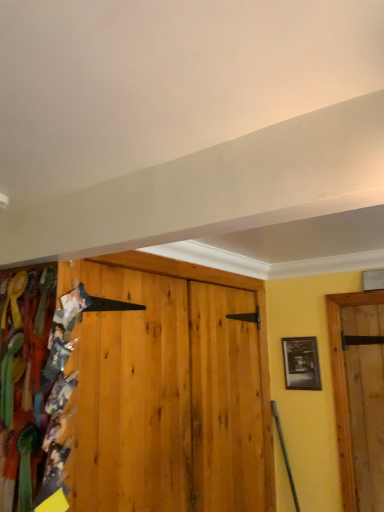
Question: Do you think black glossy picture frame at right is within multicolored fabric at left, or outside of it?

Choices:
 (A) inside
 (B) outside

Answer: (B)

Question: Based on their positions, is black glossy picture frame at right located to the left or right of multicolored fabric at left?

Choices:
 (A) right
 (B) left

Answer: (A)

Question: From a real-world perspective, is black glossy picture frame at right above or below multicolored fabric at left?

Choices:
 (A) above
 (B) below

Answer: (A)

Question: Is multicolored fabric at left situated inside black glossy picture frame at right or outside?

Choices:
 (A) inside
 (B) outside

Answer: (B)

Question: In terms of size, does multicolored fabric at left appear bigger or smaller than black glossy picture frame at right?

Choices:
 (A) small
 (B) big

Answer: (B)

Question: From a real-world perspective, is multicolored fabric at left physically located above or below black glossy picture frame at right?

Choices:
 (A) below
 (B) above

Answer: (A)

Question: Looking at their shapes, would you say multicolored fabric at left is wider or thinner than black glossy picture frame at right?

Choices:
 (A) thin
 (B) wide

Answer: (B)